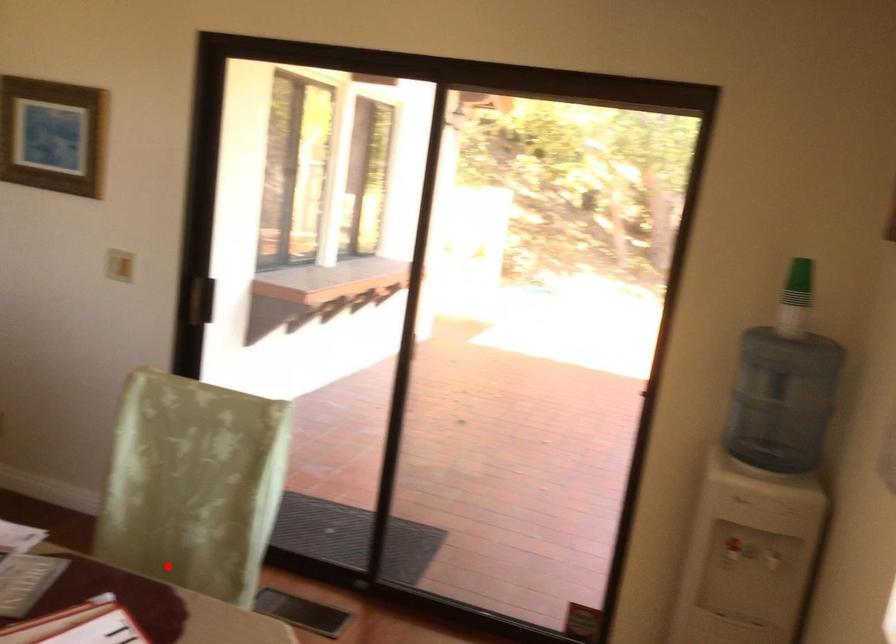
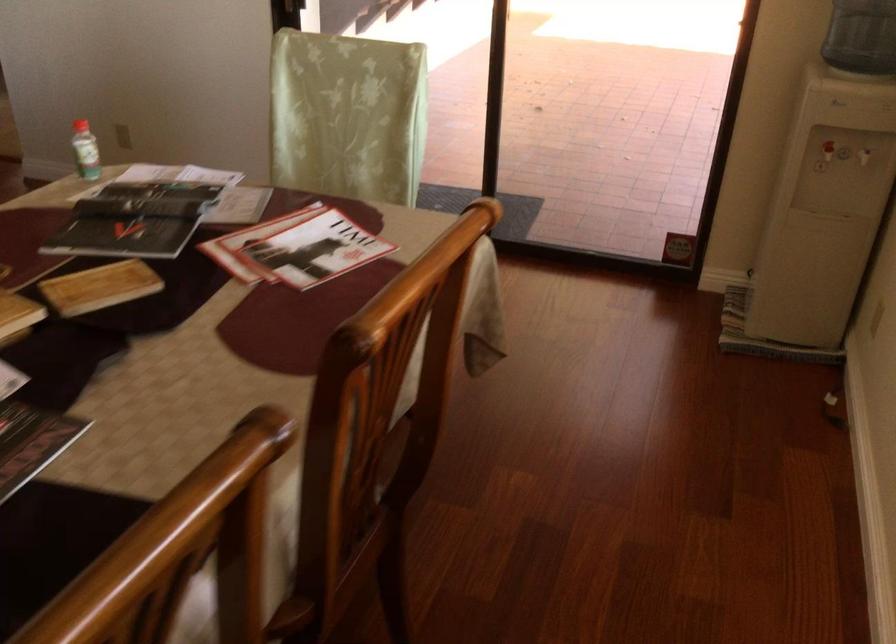
Question: I am providing you with two images of the same scene from different viewpoints. A red point is marked on the first image. At the location where the point appears in image 1, is it still visible in image 2?

Choices:
 (A) Yes
 (B) No

Answer: (B)